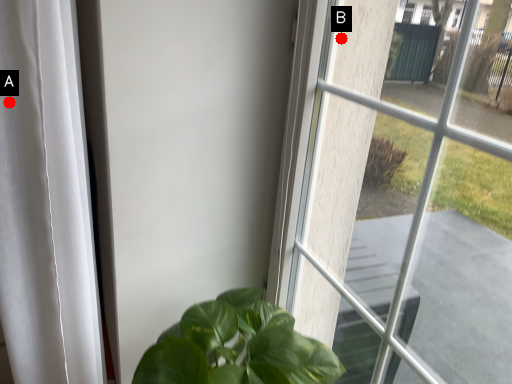
Question: Two points are circled on the image, labeled by A and B beside each circle. Which point appears farthest from the camera in this image?

Choices:
 (A) A is further
 (B) B is further

Answer: (B)